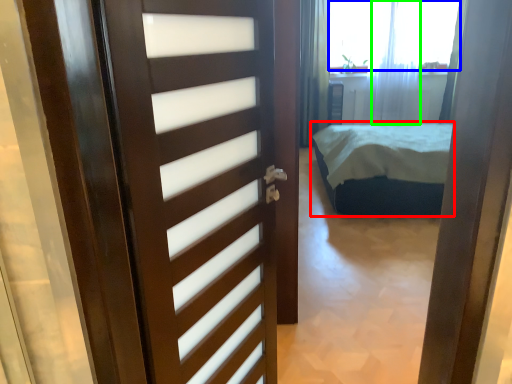
Question: Estimate the real-world distances between objects in this image. Which object is closer to bed (highlighted by a red box), window screen (highlighted by a blue box) or curtain (highlighted by a green box)?

Choices:
 (A) window screen
 (B) curtain

Answer: (B)